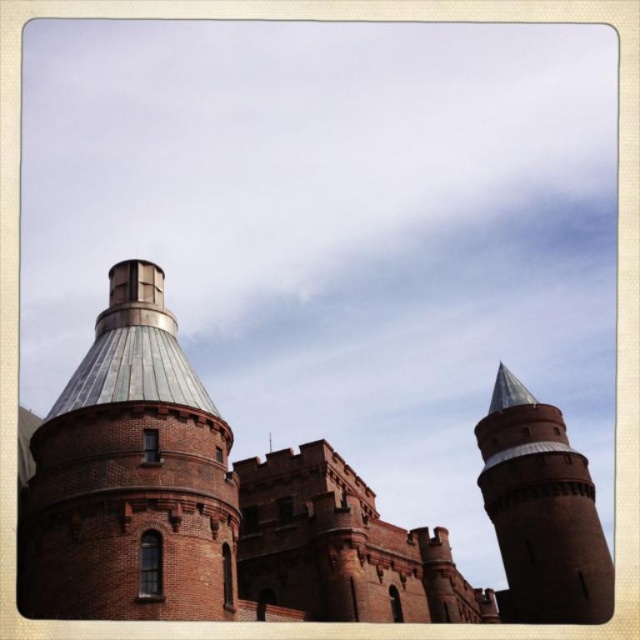
Question: Is red brick castle at center above brick tower at upper right?

Choices:
 (A) no
 (B) yes

Answer: (A)

Question: Which object is the closest to the red brick castle at center?

Choices:
 (A) brick tower at upper right
 (B) shiny metallic dome at center

Answer: (A)

Question: Based on their relative distances, which object is farther from the brick tower at upper right?

Choices:
 (A) shiny metallic dome at center
 (B) red brick castle at center

Answer: (A)

Question: From the image, what is the correct spatial relationship of red brick castle at center in relation to brick tower at upper right?

Choices:
 (A) right
 (B) left

Answer: (B)

Question: Can you confirm if red brick castle at center is bigger than shiny metallic dome at center?

Choices:
 (A) no
 (B) yes

Answer: (B)

Question: Which point is closer to the camera?

Choices:
 (A) (492, 400)
 (B) (209, 486)
 (C) (42, 508)

Answer: (C)